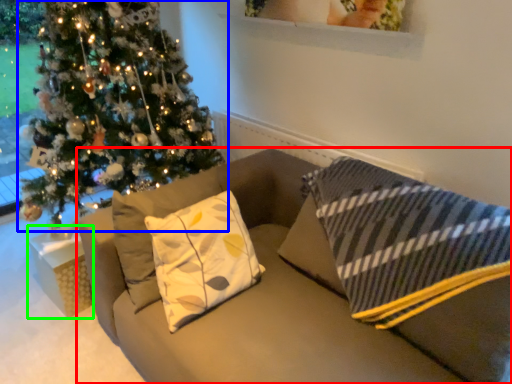
Question: Which object is positioned farthest from studio couch (highlighted by a red box)? Select from christmas tree (highlighted by a blue box) and furniture (highlighted by a green box).

Choices:
 (A) christmas tree
 (B) furniture

Answer: (A)